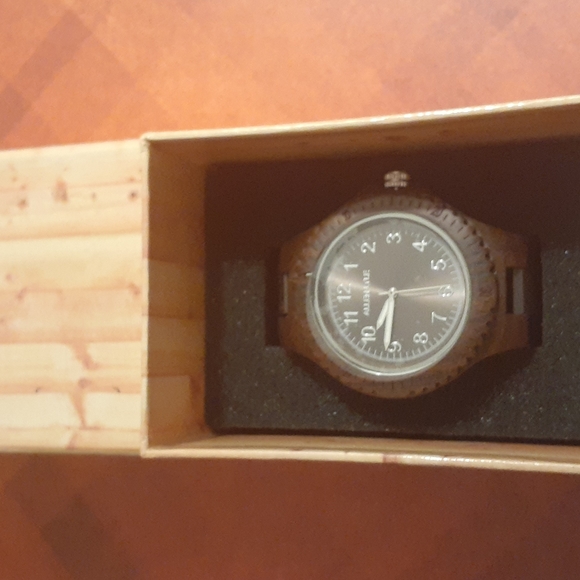
What are the coordinates of `table` in the screenshot? It's located at (503, 124).